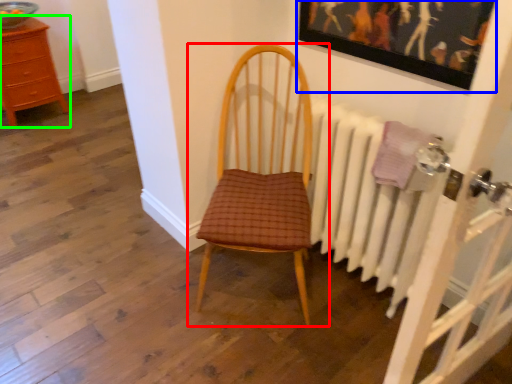
Question: Considering the real-world distances, which object is closest to chair (highlighted by a red box)? picture frame (highlighted by a blue box) or chest of drawers (highlighted by a green box).

Choices:
 (A) picture frame
 (B) chest of drawers

Answer: (A)